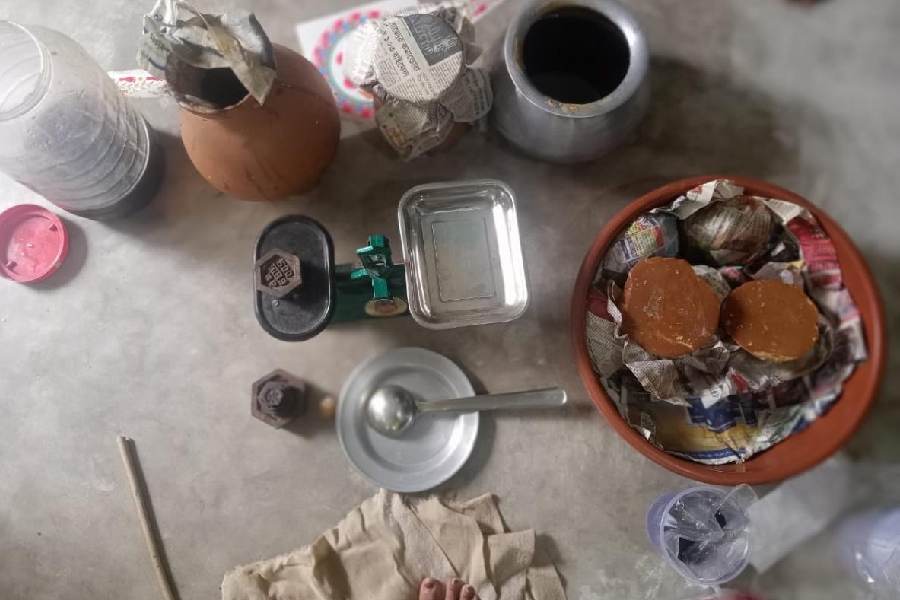
At what (x,y) coordinates should I click in order to perform the action: click on plastic cups. Please return your answer as a coordinate pair (x, y). Looking at the image, I should click on (882, 553), (726, 569).